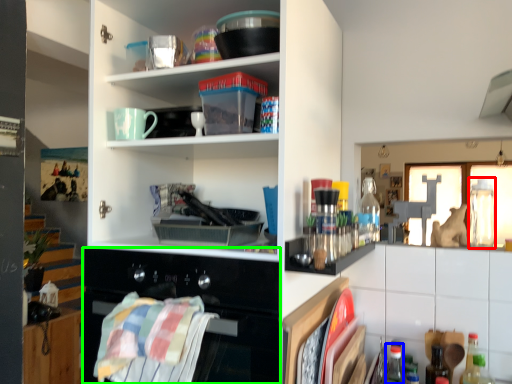
Question: Considering the real-world distances, which object is farthest from bottle (highlighted by a red box)? bottle (highlighted by a blue box) or oven (highlighted by a green box)?

Choices:
 (A) bottle
 (B) oven

Answer: (B)